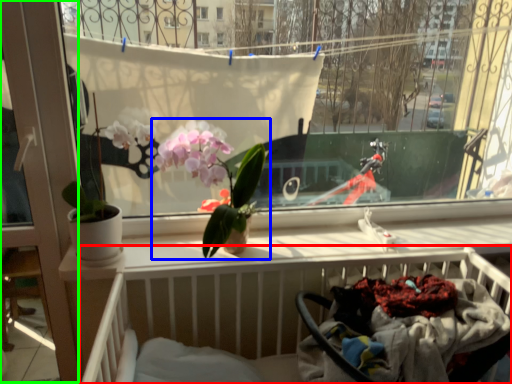
Question: Based on their relative distances, which object is farther from hospital bed (highlighted by a red box)? Choose from houseplant (highlighted by a blue box) and screen door (highlighted by a green box).

Choices:
 (A) houseplant
 (B) screen door

Answer: (B)